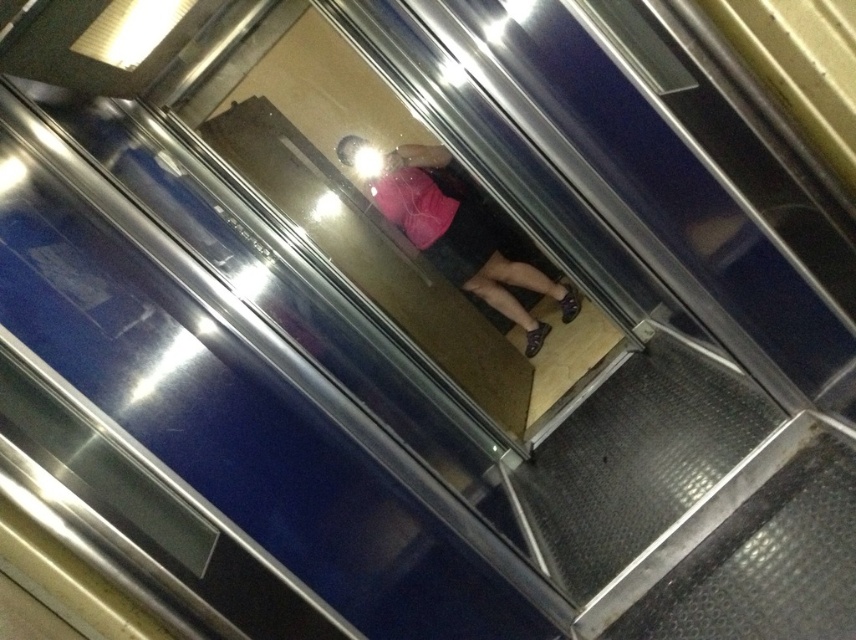
Measure the distance between metallic textured stair at lower right and camera.

metallic textured stair at lower right and camera are 1.80 meters apart from each other.

The image size is (856, 640). What do you see at coordinates (634, 460) in the screenshot?
I see `metallic textured stair at lower right` at bounding box center [634, 460].

Is point (664, 380) closer to viewer compared to point (408, 188)?

That is True.

This screenshot has height=640, width=856. In order to click on metallic textured stair at lower right in this screenshot , I will do `click(634, 460)`.